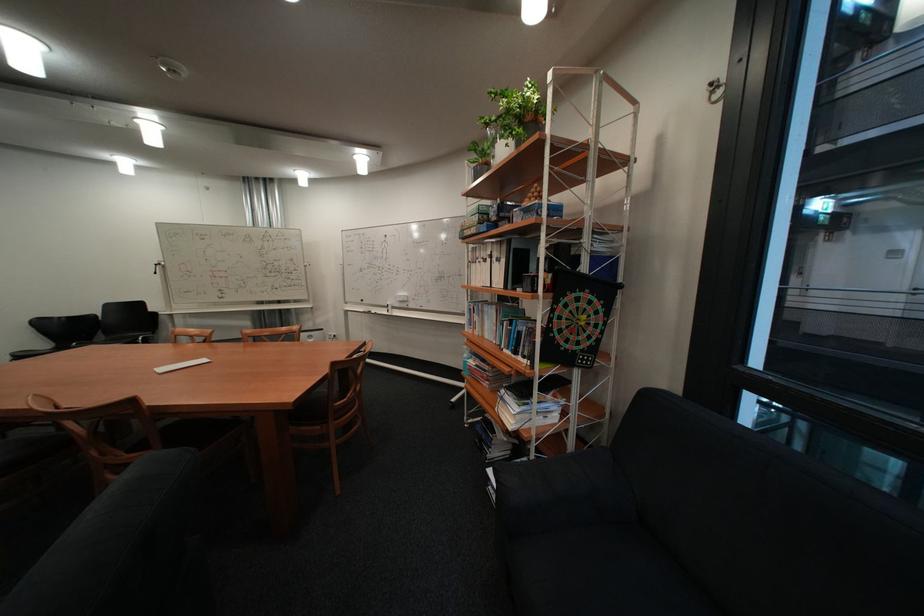
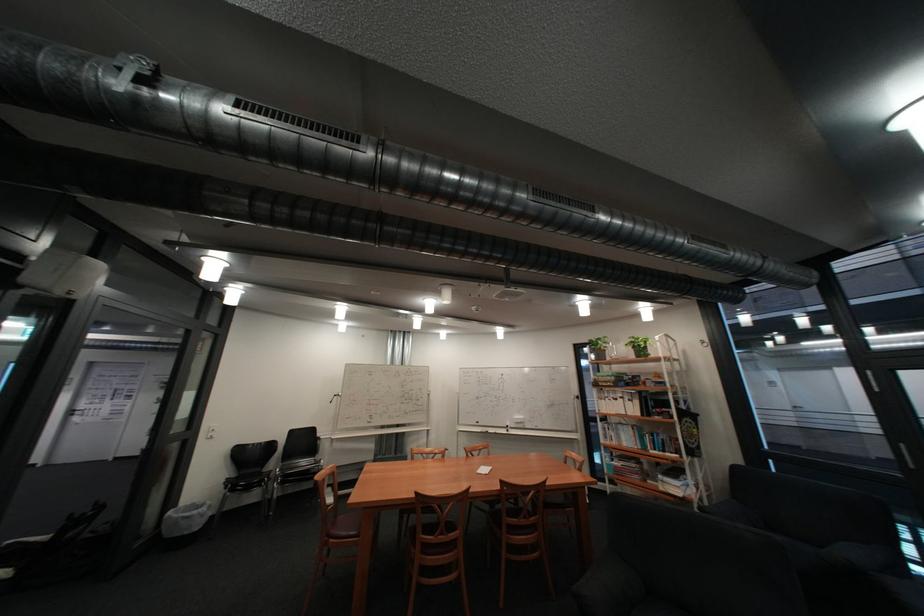
Consider the image. The images are taken continuously from a first-person perspective. In which direction are you moving?

The movement direction of the cameraman is left, backward.